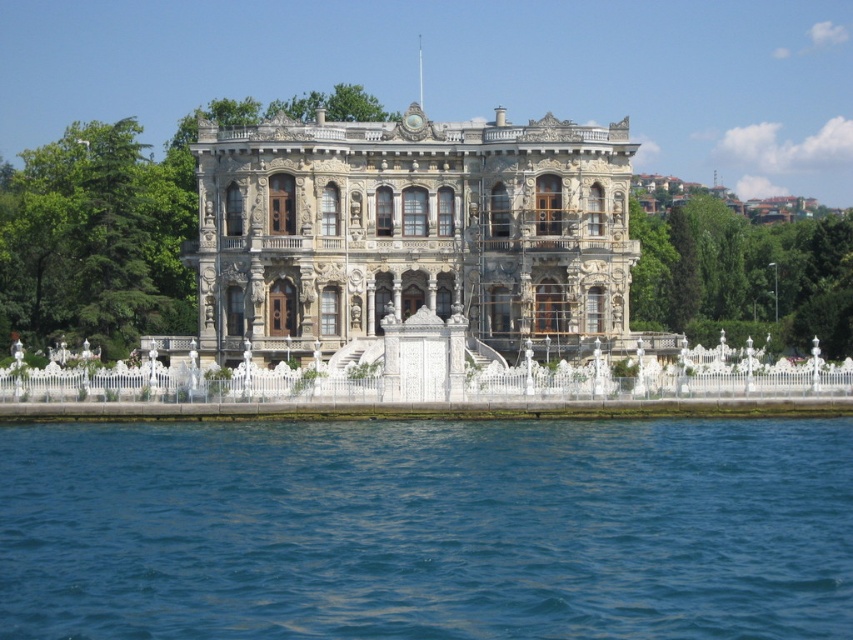
Question: Does blue liquid water at lower center have a larger size compared to white stone palace at center?

Choices:
 (A) no
 (B) yes

Answer: (A)

Question: Which object appears closest to the camera in this image?

Choices:
 (A) white stone palace at center
 (B) blue liquid water at lower center

Answer: (B)

Question: Does blue liquid water at lower center have a greater width compared to white stone palace at center?

Choices:
 (A) yes
 (B) no

Answer: (A)

Question: Is blue liquid water at lower center further to the viewer compared to white stone palace at center?

Choices:
 (A) yes
 (B) no

Answer: (B)

Question: Which point is closer to the camera?

Choices:
 (A) (186, 595)
 (B) (380, 348)

Answer: (A)